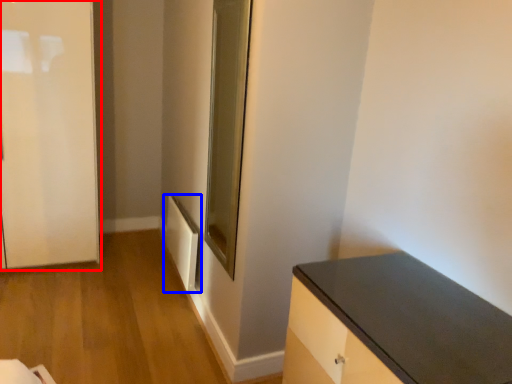
Question: Which object appears farthest to the camera in this image, door (highlighted by a red box) or radiator (highlighted by a blue box)?

Choices:
 (A) door
 (B) radiator

Answer: (B)